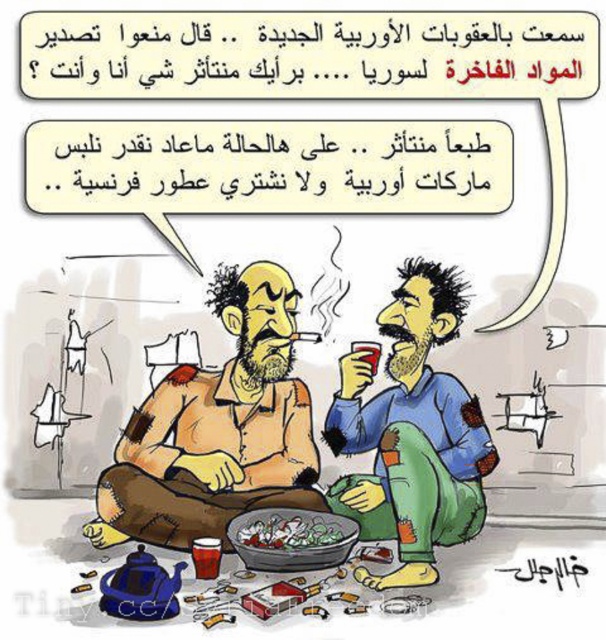
Question: Which point is farther to the camera?

Choices:
 (A) (218, 392)
 (B) (422, 260)

Answer: (B)

Question: Is brown leather jacket at center above green leafy vegetables at center?

Choices:
 (A) yes
 (B) no

Answer: (A)

Question: Can you confirm if brown leather jacket at center is positioned to the right of green leafy vegetables at center?

Choices:
 (A) yes
 (B) no

Answer: (B)

Question: Which point is closer to the camera taking this photo?

Choices:
 (A) (112, 480)
 (B) (439, 525)
 (C) (251, 524)

Answer: (B)

Question: Which point appears farthest from the camera in this image?

Choices:
 (A) (247, 500)
 (B) (238, 529)

Answer: (A)

Question: Does brown leather jacket at center have a smaller size compared to green leafy vegetables at center?

Choices:
 (A) yes
 (B) no

Answer: (B)